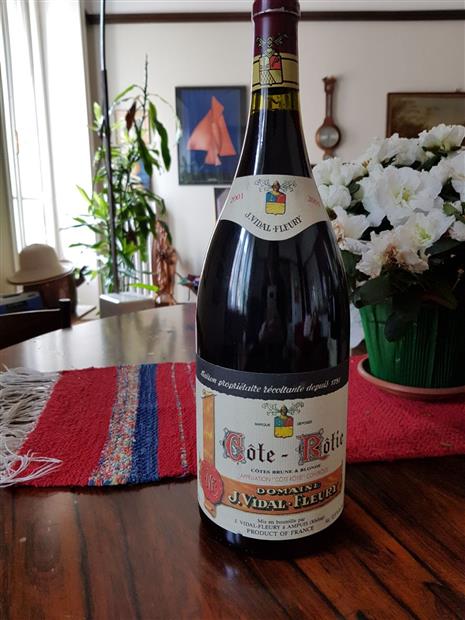
This screenshot has width=465, height=620. Identify the location of wood panel table. tap(130, 569).